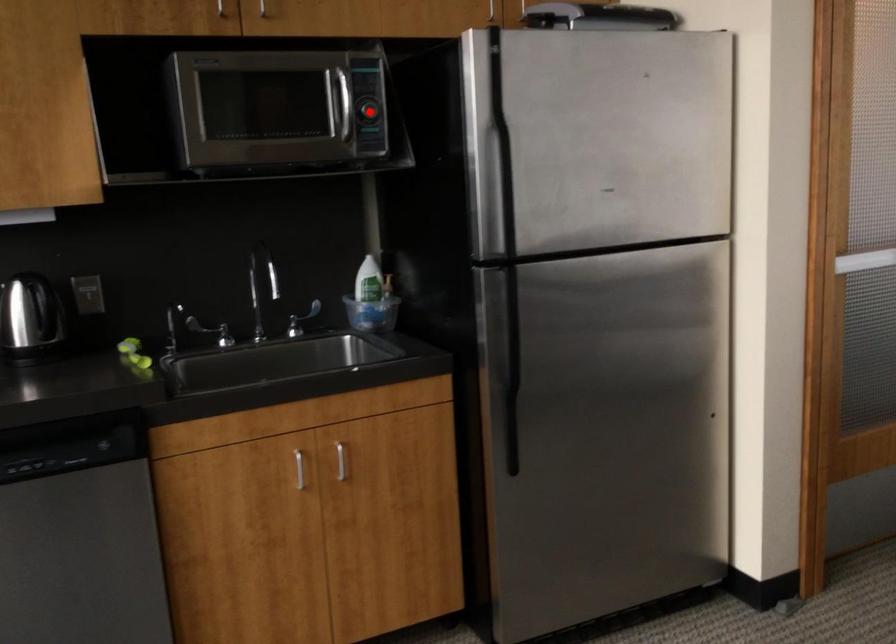
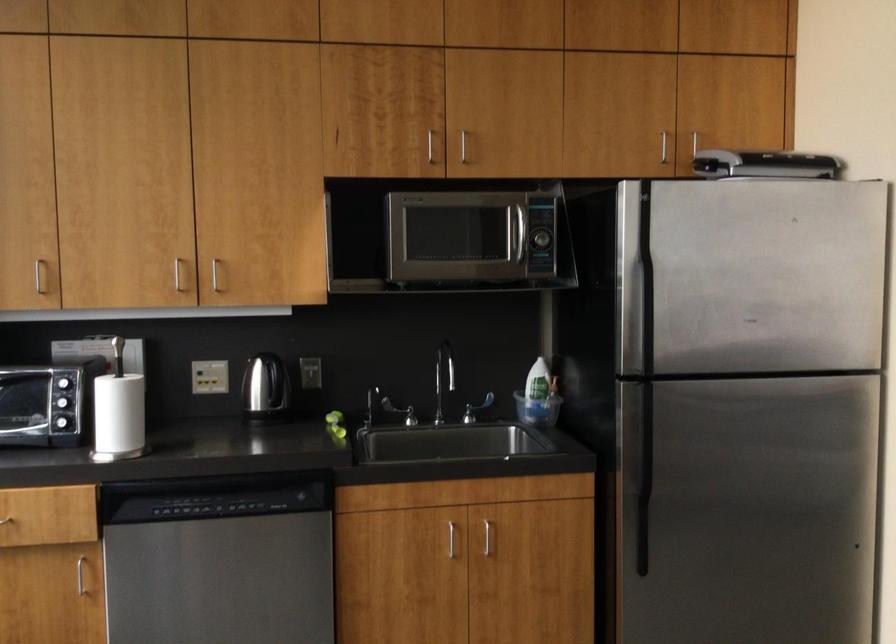
Find the pixel in the second image that matches the highlighted location in the first image.

(540, 239)